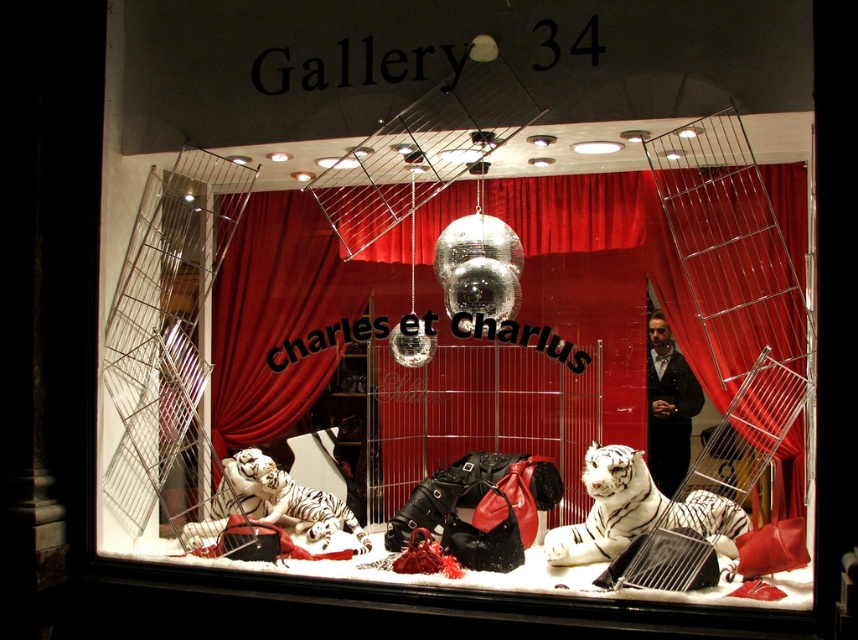
You are a customer at Gallery 34 and want to know which tiger is bigger. The store has a white fur tiger at center and a white ceramic tiger at lower left. Can you tell me which one is wider?

The white fur tiger at center is wider than the white ceramic tiger at lower left.

You are a customer at Gallery 34 and want to know which tiger is bigger between the white fur tiger at center and the white ceramic tiger at lower left. Can you tell me?

The white fur tiger at center is taller than the white ceramic tiger at lower left.